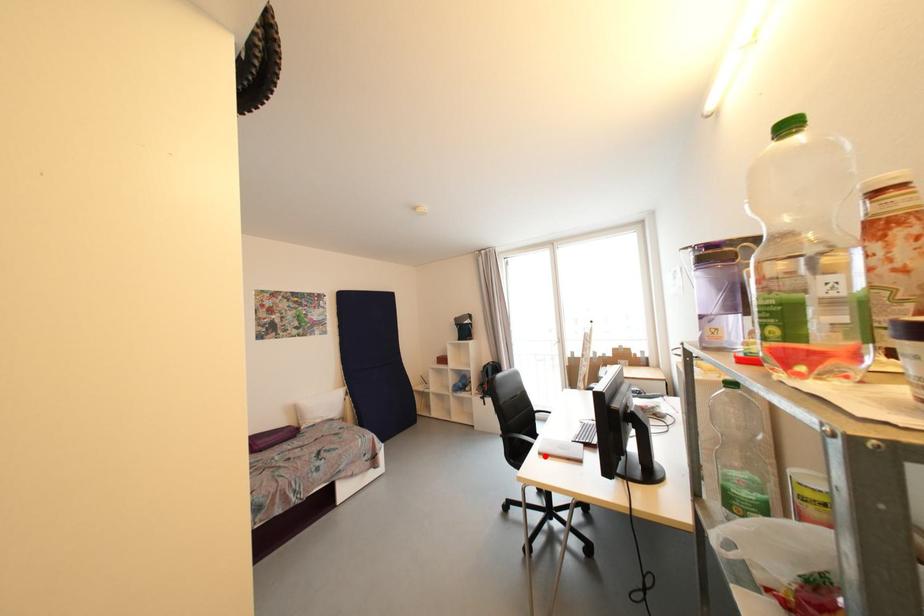
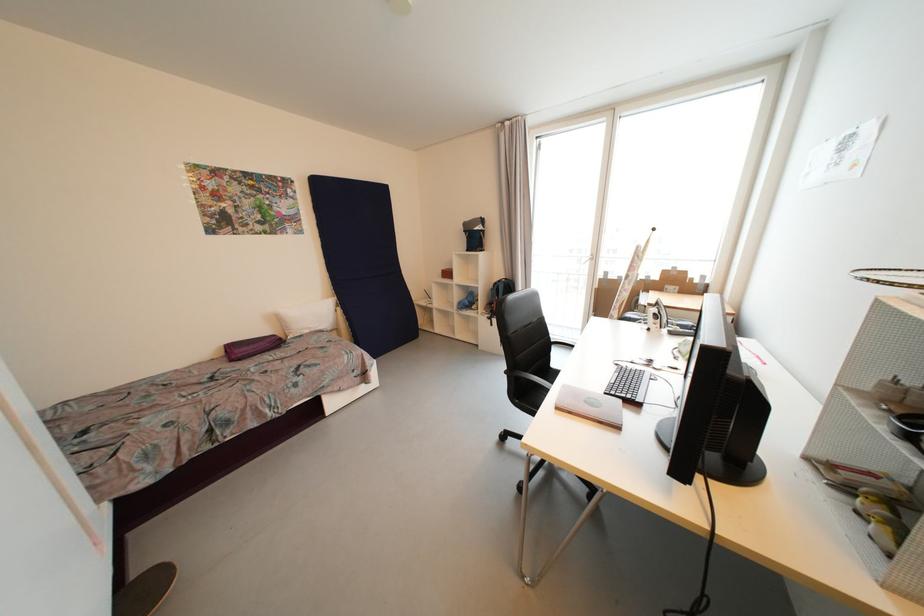
Locate, in the second image, the point that corresponds to the highlighted location in the first image.

(562, 410)